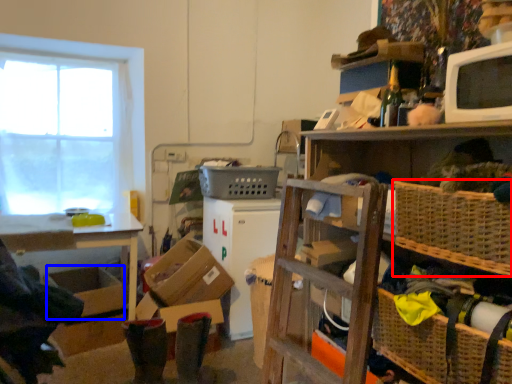
Question: Which object appears farthest to the camera in this image, basket (highlighted by a red box) or storage box (highlighted by a blue box)?

Choices:
 (A) basket
 (B) storage box

Answer: (B)